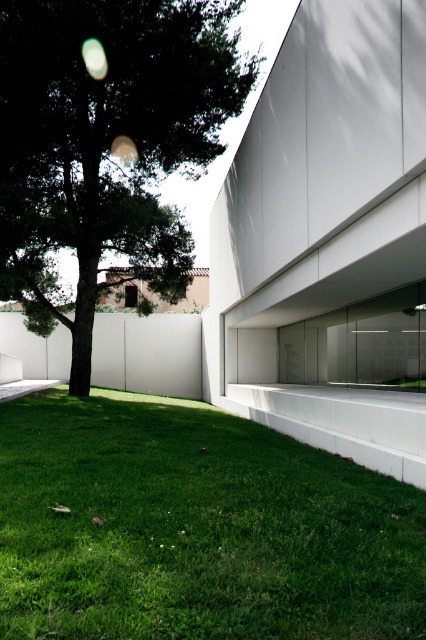
Question: Can you confirm if green grass at lower left is bigger than green leafy tree at left?

Choices:
 (A) no
 (B) yes

Answer: (A)

Question: Is green grass at lower left positioned behind green leafy tree at left?

Choices:
 (A) no
 (B) yes

Answer: (A)

Question: Which point is farther to the camera?

Choices:
 (A) green grass at lower left
 (B) green leafy tree at left

Answer: (B)

Question: Among these points, which one is nearest to the camera?

Choices:
 (A) (127, 160)
 (B) (314, 592)

Answer: (B)

Question: Is green grass at lower left behind green leafy tree at left?

Choices:
 (A) yes
 (B) no

Answer: (B)